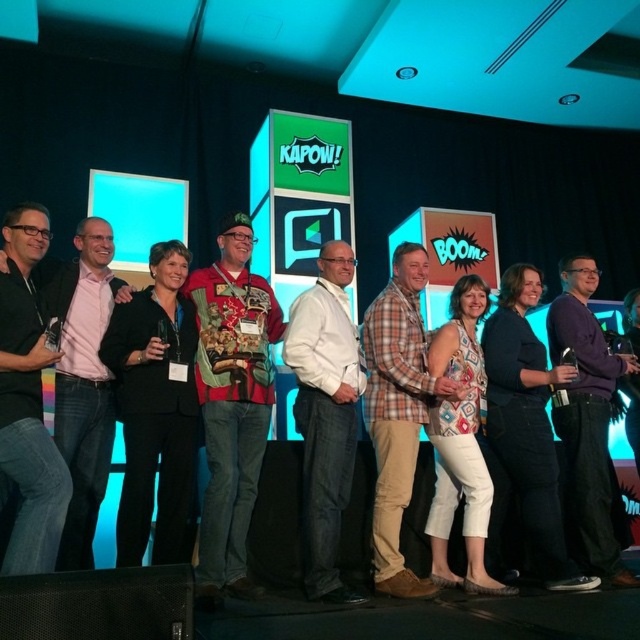
You are a photographer at the event and want to ensure both the black matte suit at left and the purple cotton shirt at center are clearly visible in your photo. Based on their positions, which one should you focus on first to ensure both are in frame?

Since the black matte suit at left is to the left of the purple cotton shirt at center, you should focus on the purple cotton shirt at center first to ensure both are in frame.

You are a photographer at this event. You want to ensure the black matte suit at left and the purple cotton shirt at center are both visible in your photo. Based on their sizes, which one might require you to adjust your camera angle to capture more detail?

The black matte suit at left is smaller than the purple cotton shirt at center, so you might need to adjust your camera angle to focus more on the smaller black matte suit at left to ensure it is visible.

You are a photographer at the event and want to ensure that both the plaid cotton shirt at center and the purple cotton shirt at center are clearly visible in your photo. Given their height difference, which of the two shirts should you adjust the camera angle to focus on to ensure both are in frame?

The plaid cotton shirt at center is much taller than the purple cotton shirt at center. To ensure both are in frame, you should lower the camera angle slightly to capture the taller plaid cotton shirt at center while still keeping the shorter purple cotton shirt at center in view.